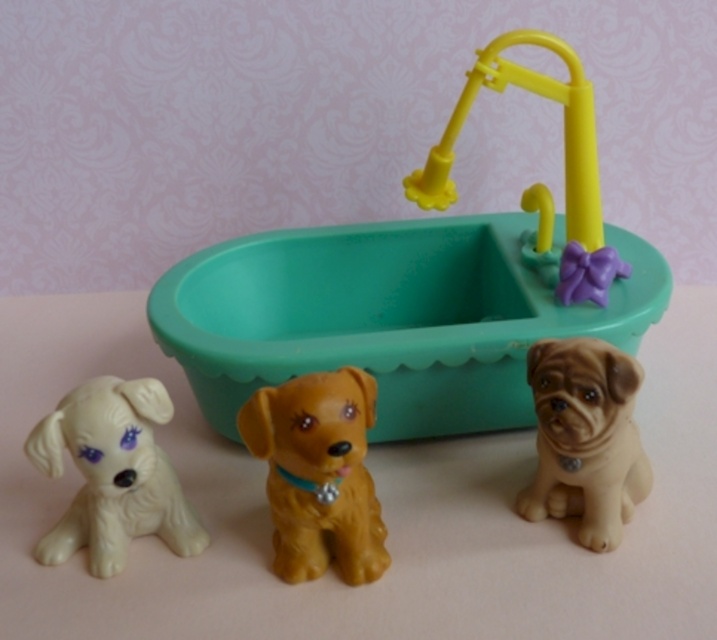
Does shiny brown dog at center have a greater width compared to white glossy dog at lower left?

In fact, shiny brown dog at center might be narrower than white glossy dog at lower left.

Can you confirm if shiny brown dog at center is positioned above white glossy dog at lower left?

No, shiny brown dog at center is not above white glossy dog at lower left.

Which is behind, point (361, 522) or point (105, 508)?

Positioned behind is point (105, 508).

What are the coordinates of `shiny brown dog at center` in the screenshot? It's located at (318, 474).

Which of these two, shiny brown dog at center or brown matte dog at right, stands shorter?

Standing shorter between the two is brown matte dog at right.

Who is positioned more to the left, shiny brown dog at center or brown matte dog at right?

shiny brown dog at center

What are the coordinates of `shiny brown dog at center` in the screenshot? It's located at (318, 474).

Can you confirm if white glossy dog at lower left is thinner than yellow plastic faucet at upper center?

Correct, white glossy dog at lower left's width is less than yellow plastic faucet at upper center's.

Is white glossy dog at lower left above yellow plastic faucet at upper center?

No.

Between point (92, 467) and point (541, 45), which one is positioned behind?

Point (541, 45)

The height and width of the screenshot is (640, 717). Find the location of `white glossy dog at lower left`. white glossy dog at lower left is located at coordinates (113, 474).